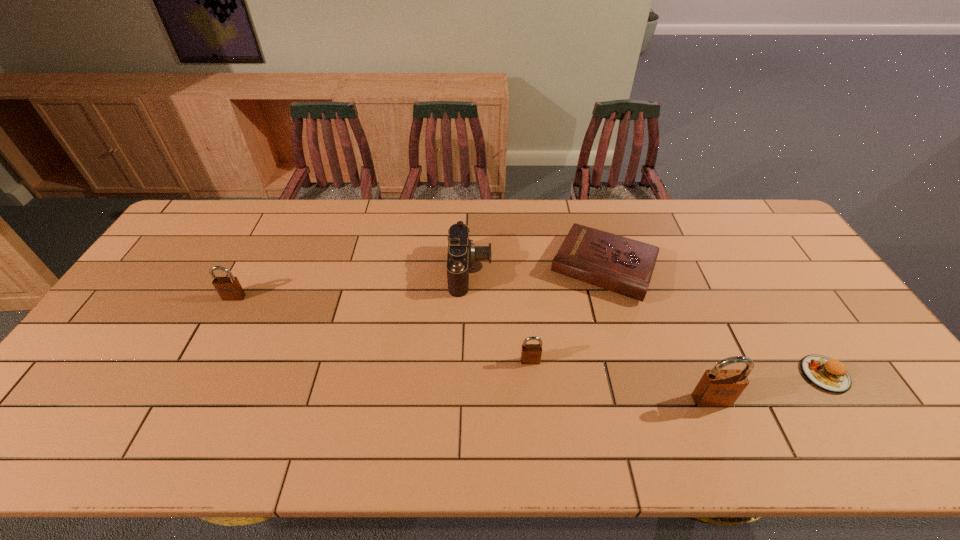
To make them evenly spaced by inserting another padlock among them, please locate a vacant spot for this new padlock. Please provide its 2D coordinates. Your answer should be formatted as a tuple, i.e. [(x, y)], where the tuple contains the x and y coordinates of a point satisfying the conditions above.

[(372, 327)]